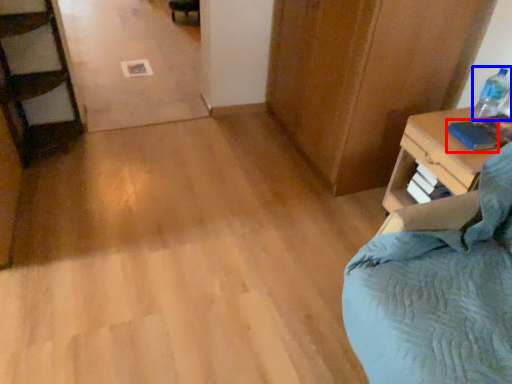
Question: Which of the following is the closest to the observer, book (highlighted by a red box) or bottle (highlighted by a blue box)?

Choices:
 (A) book
 (B) bottle

Answer: (A)